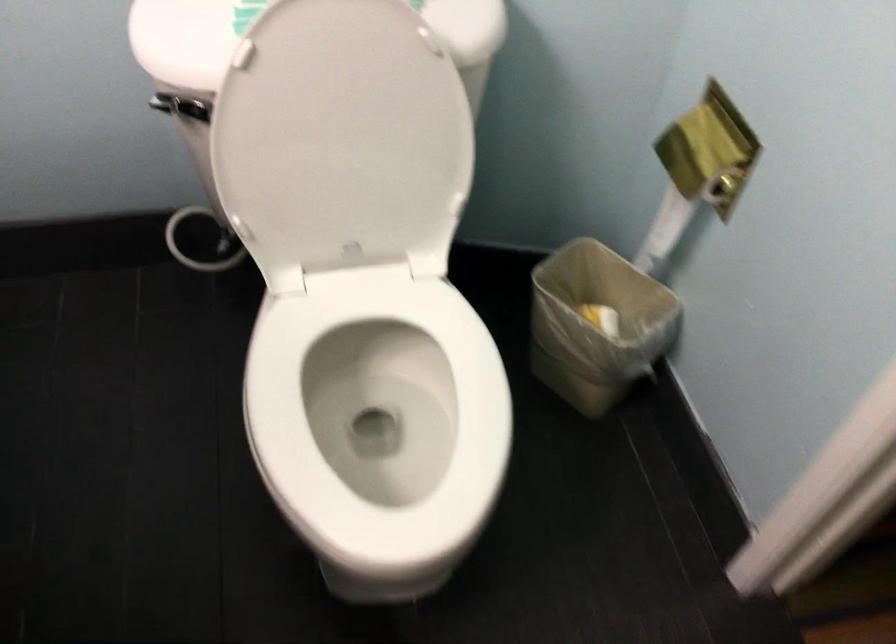
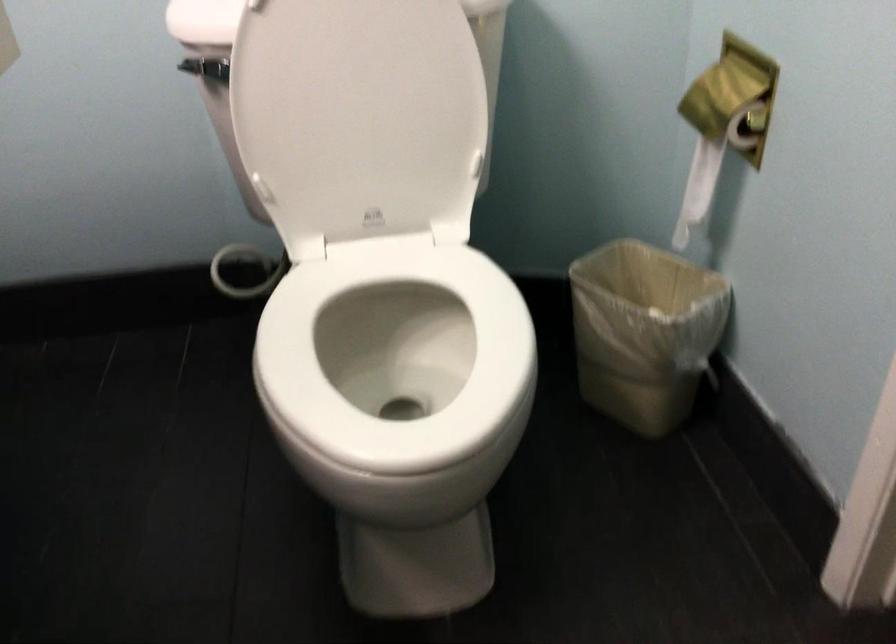
Find the pixel in the second image that matches (x=367, y=368) in the first image.

(395, 359)